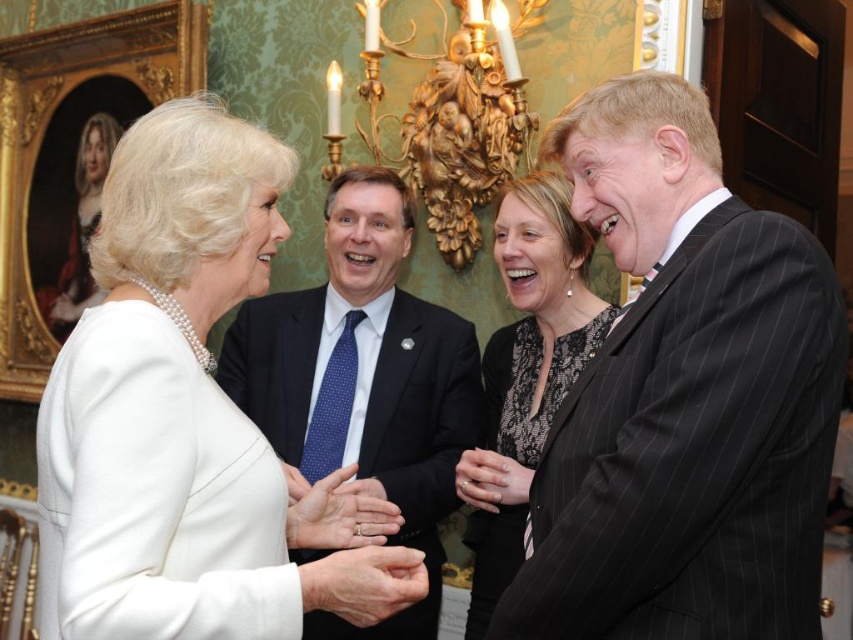
Question: Which object is positioned closest to the black lace dress at center?

Choices:
 (A) white pearl ring at center
 (B) black pinstripe suit at right
 (C) white matte ring at center
 (D) white pearl necklace at upper left

Answer: (A)

Question: Which of the following is the farthest from the observer?

Choices:
 (A) (759, 625)
 (B) (296, 541)
 (C) (502, 538)

Answer: (C)

Question: From the image, what is the correct spatial relationship of black pinstripe suit at right in relation to white pearl ring at center?

Choices:
 (A) left
 (B) right

Answer: (B)

Question: Is the position of dark blue textured suit at center more distant than that of white matte ring at center?

Choices:
 (A) yes
 (B) no

Answer: (A)

Question: Does black lace dress at center come behind smooth skin hand at center?

Choices:
 (A) no
 (B) yes

Answer: (B)

Question: Which is farther from the smooth skin hand at center?

Choices:
 (A) white matte ring at center
 (B) dark blue textured suit at center
 (C) white pearl necklace at upper left
 (D) black lace dress at center

Answer: (D)